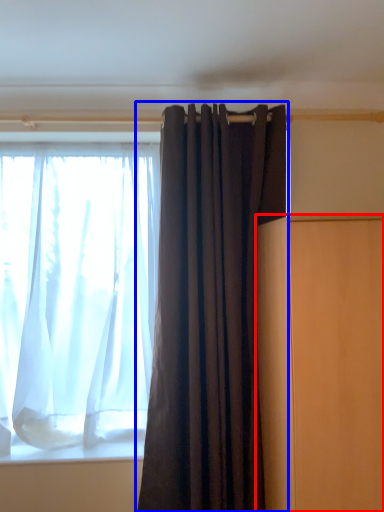
Question: Which object is closer to the camera taking this photo, furniture (highlighted by a red box) or curtain (highlighted by a blue box)?

Choices:
 (A) furniture
 (B) curtain

Answer: (A)